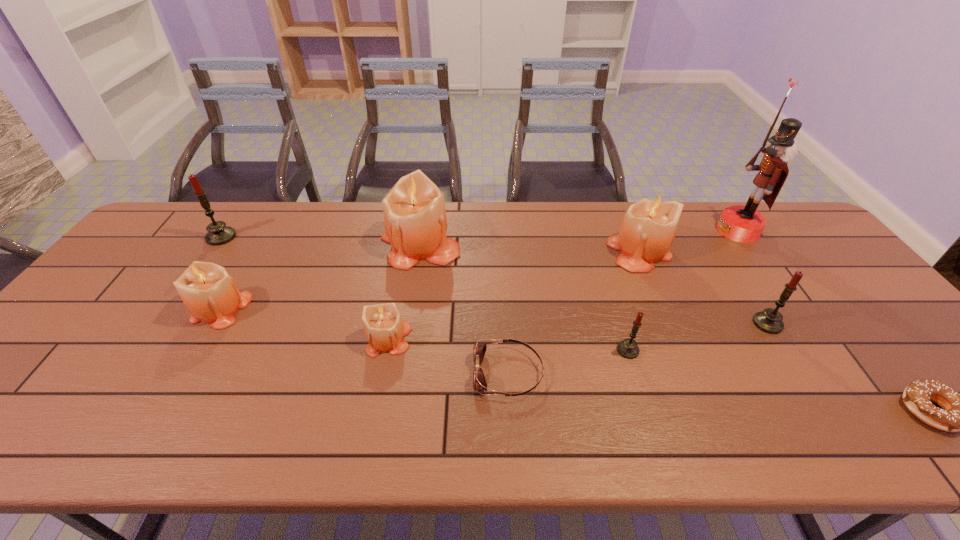
Identify the location of free location located on the right of the second candle from right to left. This screenshot has height=540, width=960. (739, 251).

Where is `free space located on the left of the rightmost candle`? The image size is (960, 540). free space located on the left of the rightmost candle is located at coordinates (684, 323).

Where is `vacant space located 0.380m on the back of the leftmost beige candle`? This screenshot has height=540, width=960. vacant space located 0.380m on the back of the leftmost beige candle is located at coordinates (278, 208).

This screenshot has width=960, height=540. I want to click on free spot located 0.370m on the left of the smallest red candle, so click(x=464, y=350).

Find the location of a particular element. The width and height of the screenshot is (960, 540). vacant region located 0.100m on the back of the smallest beige candle is located at coordinates (397, 293).

You are a GUI agent. You are given a task and a screenshot of the screen. Output one action in this format:
    pyautogui.click(x=<x>, y=<y>)
    Task: Click on the free space located 0.400m through the lenses of the sixth object from right to left
    The height and width of the screenshot is (540, 960).
    Given the screenshot: What is the action you would take?
    pyautogui.click(x=300, y=373)

You are a GUI agent. You are given a task and a screenshot of the screen. Output one action in this format:
    pyautogui.click(x=<x>, y=<y>)
    Task: Click on the vacant position located 0.250m through the lenses of the sixth object from right to left
    The height and width of the screenshot is (540, 960).
    Given the screenshot: What is the action you would take?
    pyautogui.click(x=365, y=373)

Locate an element on the screen. blank area located through the lenses of the sixth object from right to left is located at coordinates (365, 373).

The width and height of the screenshot is (960, 540). Identify the location of nutcracker that is at the far edge. (744, 224).

This screenshot has height=540, width=960. In order to click on free spot at the far edge of the desktop in this screenshot , I will do pyautogui.click(x=468, y=212).